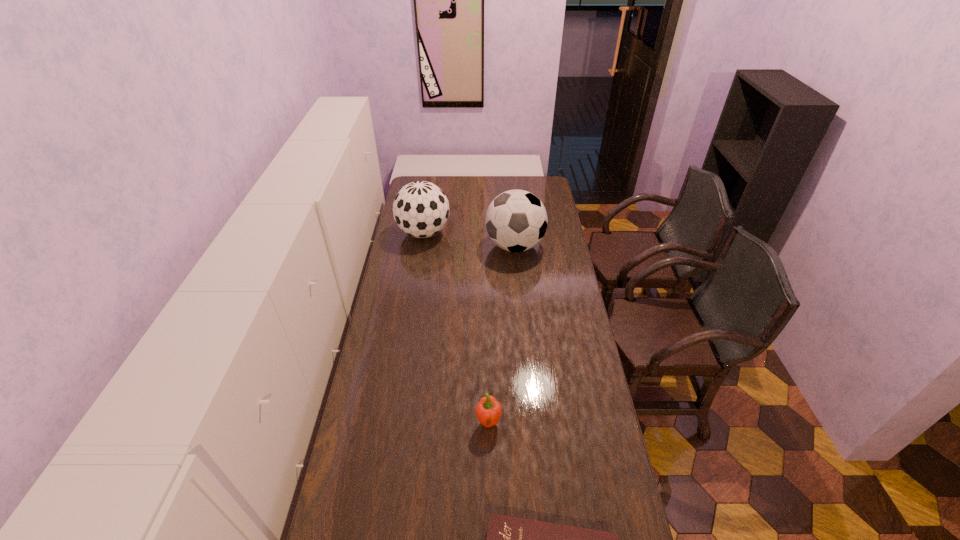
Where is `object that is at the right edge`? This screenshot has width=960, height=540. object that is at the right edge is located at coordinates (516, 220).

Where is `vacant point at the far edge`? This screenshot has width=960, height=540. vacant point at the far edge is located at coordinates (489, 181).

Find the location of a particular element. The width and height of the screenshot is (960, 540). free space at the left edge of the desktop is located at coordinates (393, 463).

Locate an element on the screen. The width and height of the screenshot is (960, 540). vacant position at the right edge of the desktop is located at coordinates (567, 334).

Locate an element on the screen. The width and height of the screenshot is (960, 540). vacant point located between the third tallest object and the right soccer ball is located at coordinates (501, 334).

In order to click on free space between the leftmost object and the pepper in this screenshot , I will do `click(456, 327)`.

Where is `vacant area that lies between the right soccer ball and the third tallest object`? The height and width of the screenshot is (540, 960). vacant area that lies between the right soccer ball and the third tallest object is located at coordinates (501, 334).

This screenshot has width=960, height=540. I want to click on free spot between the right soccer ball and the third farthest object, so click(x=501, y=334).

Where is `the second closest object relative to the third farthest object`? the second closest object relative to the third farthest object is located at coordinates [x=516, y=220].

Identify the location of object that stands as the second closest to the leftmost object. This screenshot has width=960, height=540. (488, 411).